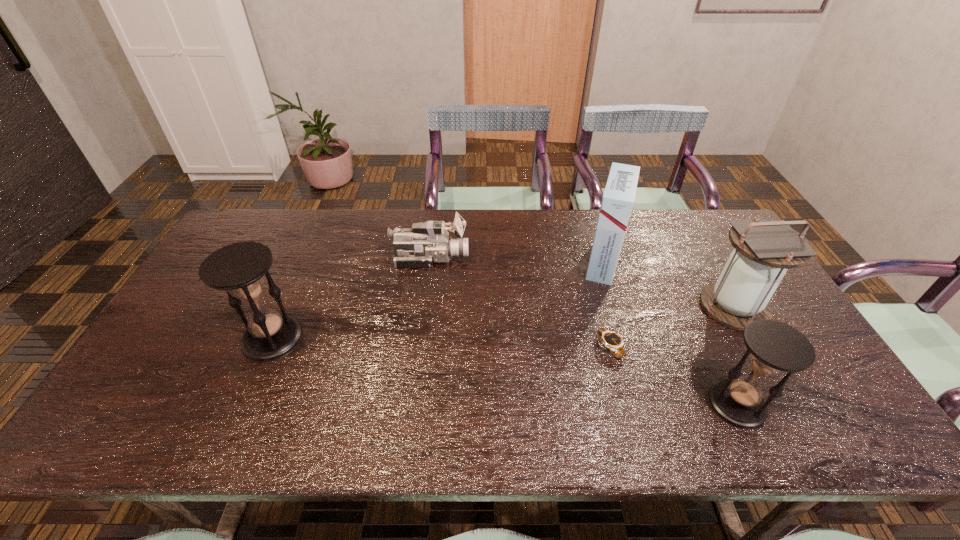
The height and width of the screenshot is (540, 960). Find the location of `free region at the near edge`. free region at the near edge is located at coordinates (375, 393).

This screenshot has width=960, height=540. I want to click on vacant space at the left edge of the desktop, so click(x=186, y=328).

Where is `vacant space at the far left corner of the desktop`? The image size is (960, 540). vacant space at the far left corner of the desktop is located at coordinates (239, 227).

In the image, there is a desktop. Where is `vacant space at the far right corner`? The width and height of the screenshot is (960, 540). vacant space at the far right corner is located at coordinates (699, 238).

Find the location of a particular element. This screenshot has height=540, width=960. free region at the near right corner is located at coordinates (800, 399).

Identify the location of unoccupied position between the cigarette case and the fourth tallest object. (670, 333).

The image size is (960, 540). I want to click on unoccupied position between the leftmost object and the fifth object from right to left, so click(351, 299).

I want to click on vacant area that lies between the lantern and the farther hourglass, so pos(503,323).

Where is `vacant space in between the shorter hourglass and the lantern`? This screenshot has height=540, width=960. vacant space in between the shorter hourglass and the lantern is located at coordinates (735, 355).

You are a GUI agent. You are given a task and a screenshot of the screen. Output one action in this format:
    pyautogui.click(x=<x>, y=<y>)
    Task: Click on the unoccupied position between the shorter hourglass and the lantern
    This screenshot has width=960, height=540.
    Given the screenshot: What is the action you would take?
    pyautogui.click(x=735, y=355)